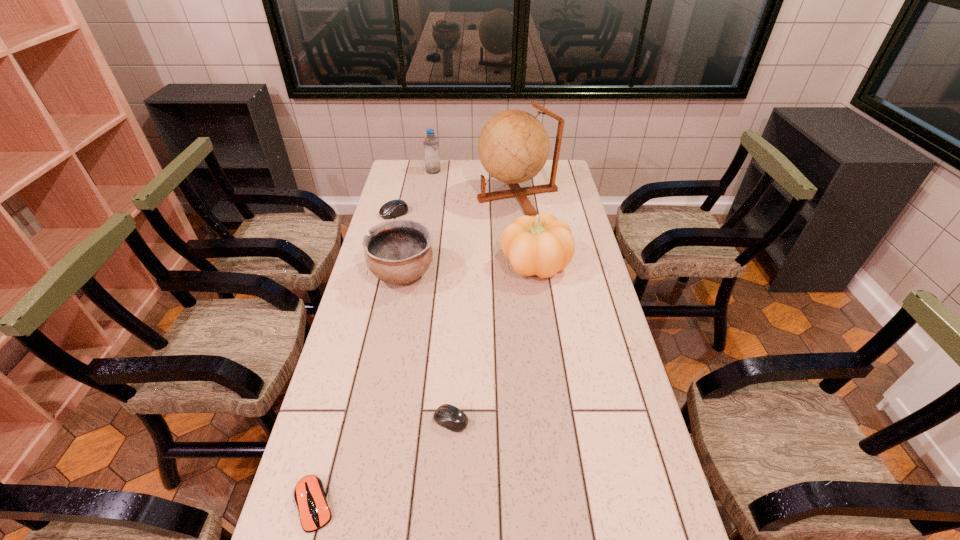
You are a GUI agent. You are given a task and a screenshot of the screen. Output one action in this format:
    pyautogui.click(x=<x>, y=<y>)
    Task: Click on the blank region between the fourth tallest object and the second shortest computer mouse
    
    Given the screenshot: What is the action you would take?
    pyautogui.click(x=427, y=347)

Locate an element on the screen. Image resolution: width=960 pixels, height=540 pixels. vacant area that lies between the globe and the water bottle is located at coordinates (475, 183).

Find the location of a particular element. Image resolution: width=960 pixels, height=540 pixels. free space that is in between the water bottle and the pumpkin is located at coordinates (484, 218).

The height and width of the screenshot is (540, 960). Find the location of `vacant space in between the nearest computer mouse and the farthest computer mouse`. vacant space in between the nearest computer mouse and the farthest computer mouse is located at coordinates (354, 359).

I want to click on vacant area between the farthest computer mouse and the blue water bottle, so click(x=414, y=192).

Locate an element on the screen. The image size is (960, 540). vacant area that lies between the fourth tallest object and the tallest object is located at coordinates (460, 234).

Locate an element on the screen. This screenshot has height=540, width=960. object that is the closest to the tallest computer mouse is located at coordinates (398, 251).

Where is `object that ranks as the fifth closest to the tallest computer mouse`? object that ranks as the fifth closest to the tallest computer mouse is located at coordinates (448, 416).

Locate which computer mouse ranks in proximity to the pumpkin. Please provide its 2D coordinates. Your answer should be formatted as a tuple, i.e. [(x, y)], where the tuple contains the x and y coordinates of a point satisfying the conditions above.

[(394, 208)]

Where is `computer mouse identified as the closest to the sixth farthest object`? The width and height of the screenshot is (960, 540). computer mouse identified as the closest to the sixth farthest object is located at coordinates (309, 494).